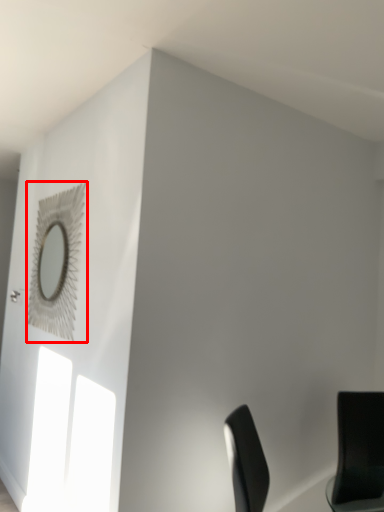
Question: From the image's perspective, considering the relative positions of mirror (annotated by the red box) and chair in the image provided, where is mirror (annotated by the red box) located with respect to the staircase?

Choices:
 (A) below
 (B) above

Answer: (B)